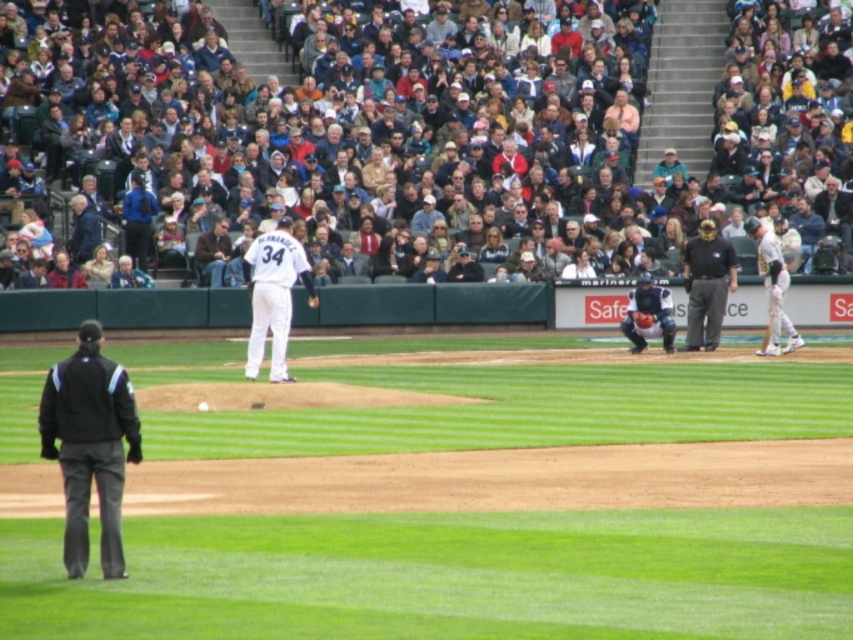
Question: Which point is closer to the camera taking this photo?

Choices:
 (A) (86, 467)
 (B) (634, 292)

Answer: (A)

Question: Which point appears farthest from the camera in this image?

Choices:
 (A) (688, 49)
 (B) (643, 317)

Answer: (A)

Question: Is black fabric jacket at lower left positioned at the back of dark blue jacket at upper left?

Choices:
 (A) yes
 (B) no

Answer: (B)

Question: Does white matte uniform at center have a smaller size compared to dark blue fabric catcher at center?

Choices:
 (A) no
 (B) yes

Answer: (B)

Question: Where is green grass at center located in relation to dark blue fabric catcher at center in the image?

Choices:
 (A) above
 (B) below

Answer: (B)

Question: Among these points, which one is farthest from the camera?

Choices:
 (A) (287, 332)
 (B) (467, 170)

Answer: (B)